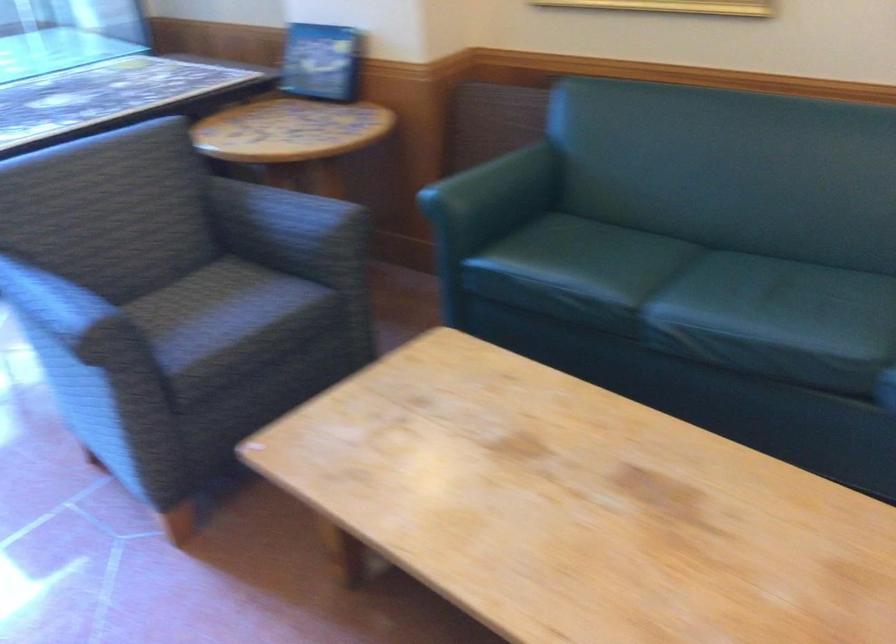
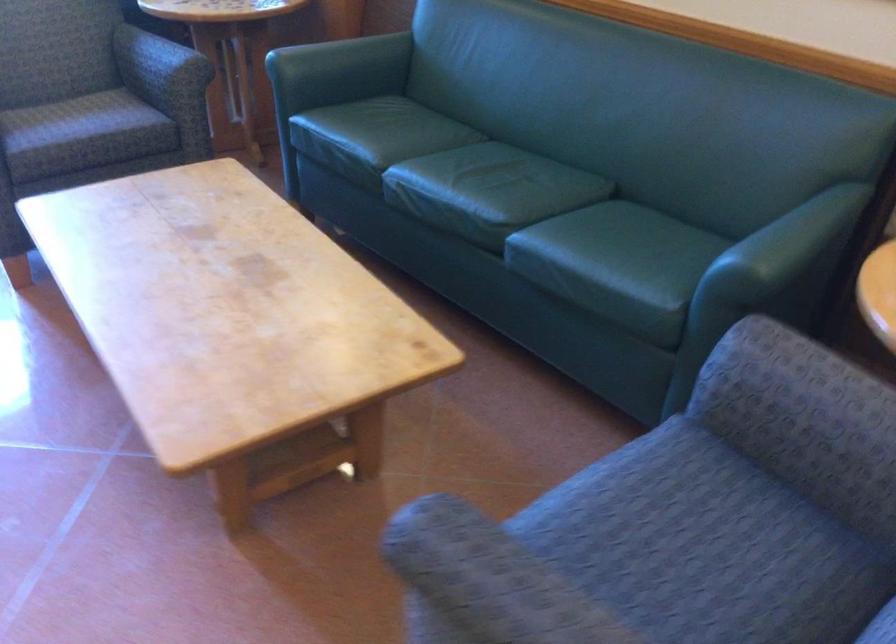
The point at (303, 231) is marked in the first image. Where is the corresponding point in the second image?

(158, 62)